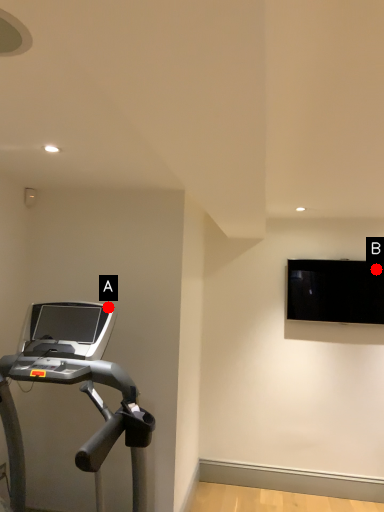
Question: Two points are circled on the image, labeled by A and B beside each circle. Which point is farther from the camera taking this photo?

Choices:
 (A) A is further
 (B) B is further

Answer: (B)